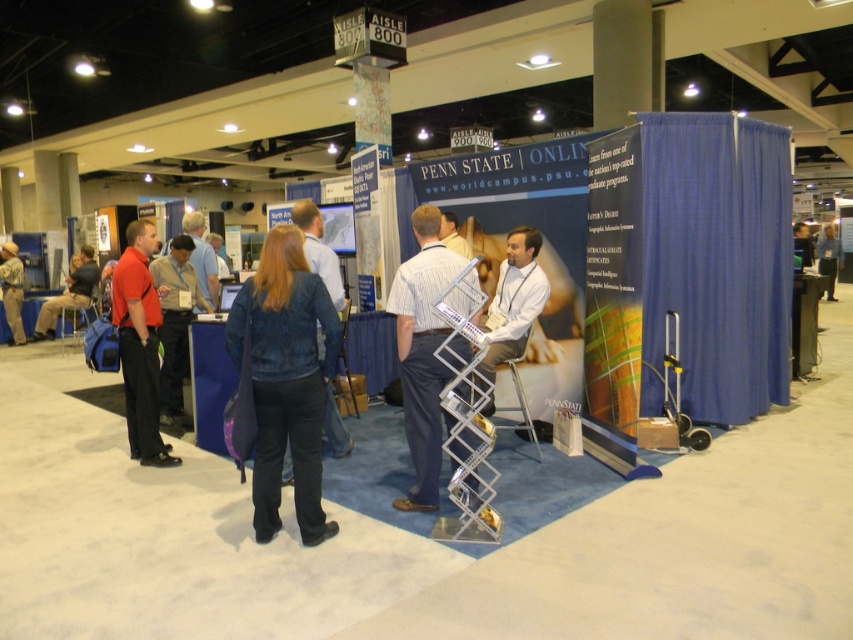
Question: Can you confirm if denim jacket at center is positioned to the left of striped cotton shirt at center?

Choices:
 (A) yes
 (B) no

Answer: (A)

Question: Which object is closer to the camera taking this photo?

Choices:
 (A) striped cotton shirt at center
 (B) denim jacket at left
 (C) denim jacket at center
 (D) blue shirt at center

Answer: (C)

Question: Based on their relative distances, which object is farther from the matte red shirt at left?

Choices:
 (A) denim jacket at center
 (B) striped cotton shirt at center
 (C) blue shirt at center

Answer: (C)

Question: Does denim jacket at center appear under matte red shirt at left?

Choices:
 (A) no
 (B) yes

Answer: (B)

Question: Which point is farther to the camera?

Choices:
 (A) (488, 356)
 (B) (163, 410)
 (C) (309, 227)
 (D) (128, 305)

Answer: (B)

Question: Is white shirt at center behind blue shirt at center?

Choices:
 (A) no
 (B) yes

Answer: (A)